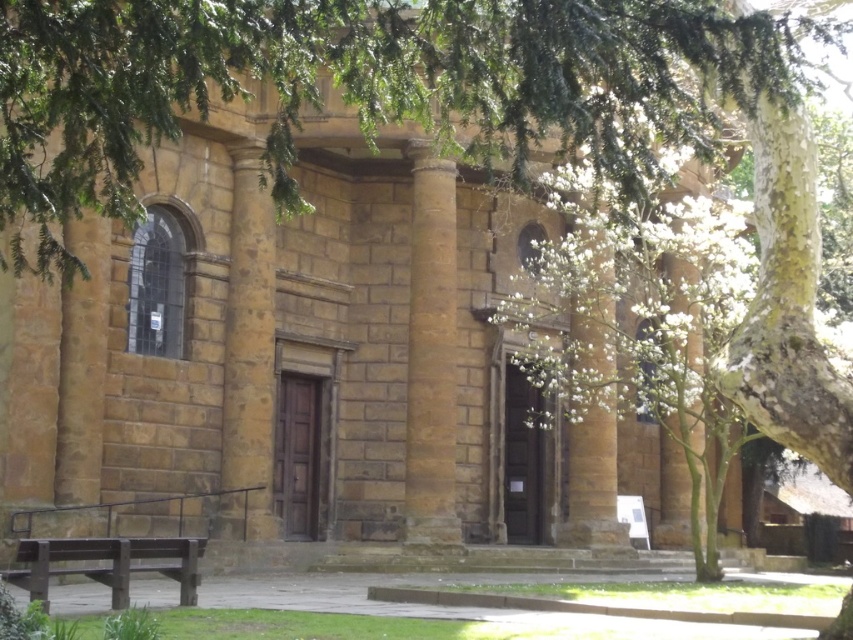
You are standing in front of the historic stone building and notice the green leafy branches at upper center. Based on their position, can you determine if they are part of the building or a separate tree?

The green leafy branches at upper center are located at point coordinates, which suggests they are part of the building as they are positioned centrally above the entrance, possibly part of a decorative element or a feature integrated into the architecture.